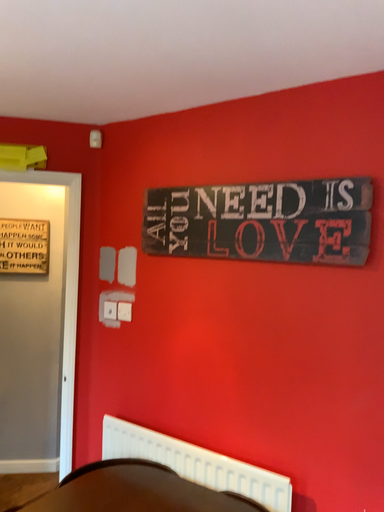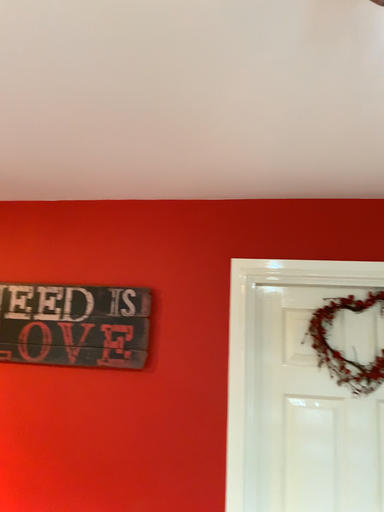
Question: Which way did the camera rotate in the video?

Choices:
 (A) rotated right
 (B) rotated left

Answer: (A)